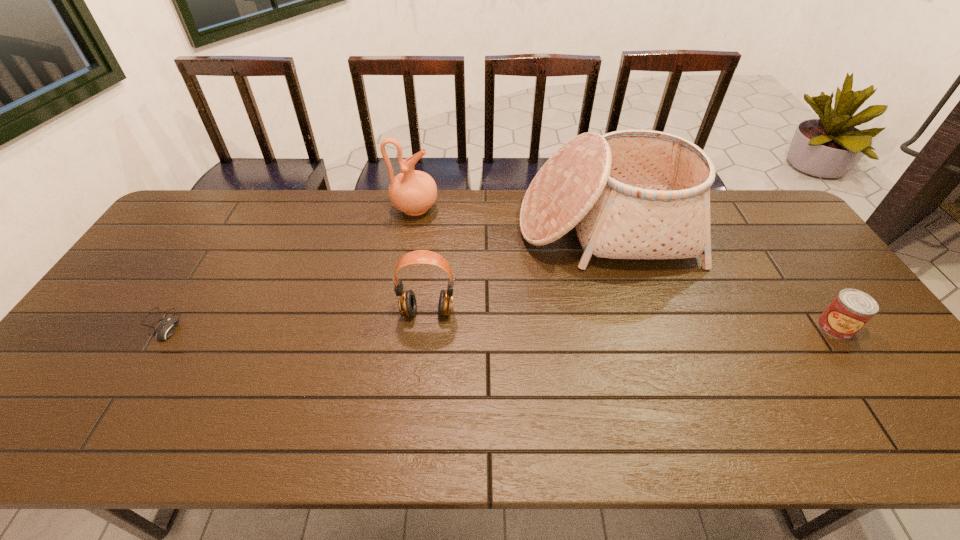
Image resolution: width=960 pixels, height=540 pixels. What are the coordinates of `basket` in the screenshot? It's located at (631, 194).

Identify the location of pottery. The height and width of the screenshot is (540, 960). (413, 192).

At what (x,y) coordinates should I click in order to perform the action: click on the third shortest object. Please return your answer as a coordinate pair (x, y). This screenshot has height=540, width=960. Looking at the image, I should click on (407, 304).

This screenshot has height=540, width=960. I want to click on the rightmost object, so click(x=851, y=309).

What are the coordinates of `the fourth tallest object` in the screenshot? It's located at (851, 309).

Find the location of a particular element. Image resolution: width=960 pixels, height=540 pixels. computer mouse is located at coordinates (167, 326).

Where is `the shortest object`? the shortest object is located at coordinates (167, 326).

Image resolution: width=960 pixels, height=540 pixels. I want to click on vacant area situated with the lid open on the second object from right to left, so click(x=628, y=303).

Where is `vacant space located on the spout of the pottery`? The image size is (960, 540). vacant space located on the spout of the pottery is located at coordinates (531, 208).

This screenshot has height=540, width=960. Identify the location of vacant space situated on the ear cups of the headset. tap(423, 354).